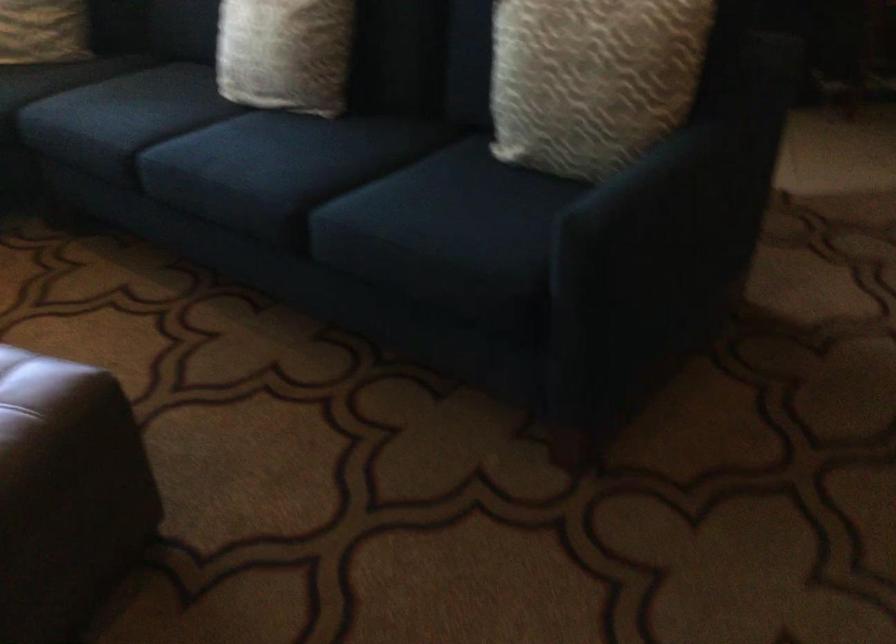
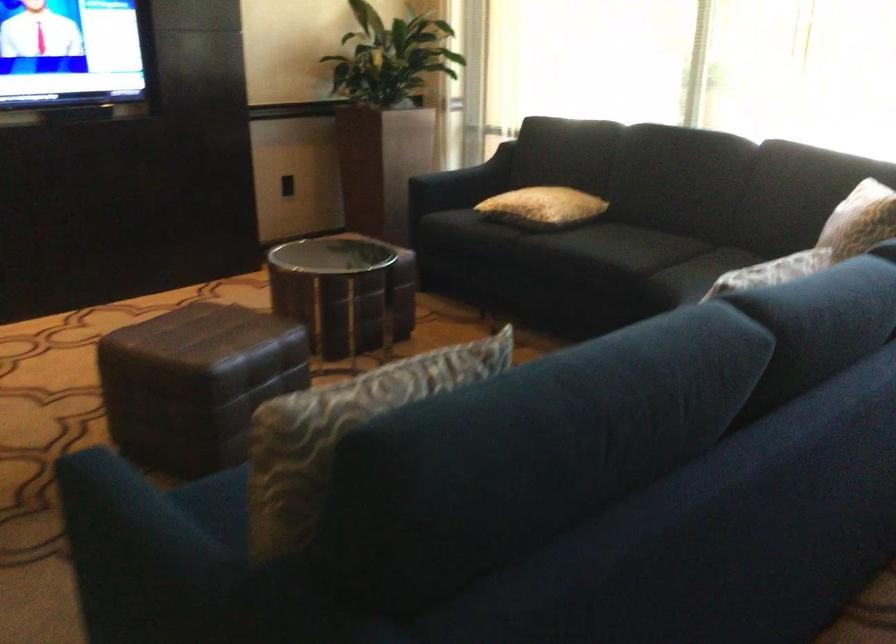
Question: I am providing you with two images of the same scene from different viewpoints. Which of the following objects are not visible in image2?

Choices:
 (A) white folded umbrella
 (B) sofa sitting surface
 (C) sofa armrest
 (D) patterned cushion

Answer: (B)